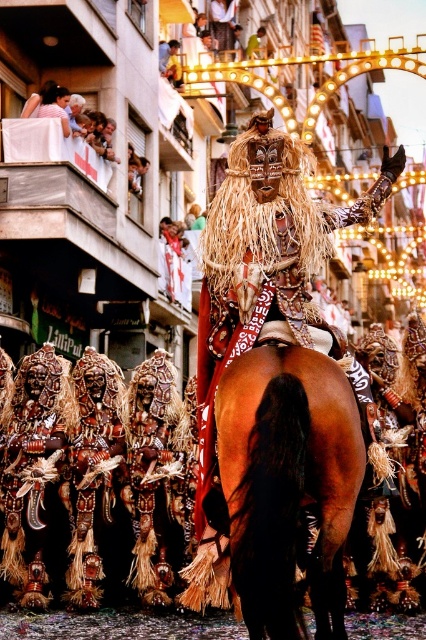
Does shiny metallic mask at center have a greater height compared to brown glossy horse at center?

Yes, shiny metallic mask at center is taller than brown glossy horse at center.

Which is behind, point (233, 349) or point (273, 538)?

Positioned behind is point (233, 349).

Where is `shiny metallic mask at center`? shiny metallic mask at center is located at coordinates (258, 300).

Does brown glossy horse at center have a greater width compared to light brown wooden balcony at upper left?

No.

Who is shorter, brown glossy horse at center or light brown wooden balcony at upper left?

With less height is light brown wooden balcony at upper left.

Measure the distance between brown glossy horse at center and camera.

A distance of 39.14 meters exists between brown glossy horse at center and camera.

In order to click on brown glossy horse at center in this screenshot , I will do `click(287, 483)`.

Is shiny metallic mask at center to the right of light brown wooden balcony at upper left from the viewer's perspective?

Yes, shiny metallic mask at center is to the right of light brown wooden balcony at upper left.

Does shiny metallic mask at center come in front of light brown wooden balcony at upper left?

Yes, shiny metallic mask at center is closer to the viewer.

This screenshot has height=640, width=426. What do you see at coordinates (258, 300) in the screenshot? I see `shiny metallic mask at center` at bounding box center [258, 300].

Locate an element on the screen. The image size is (426, 640). shiny metallic mask at center is located at coordinates (258, 300).